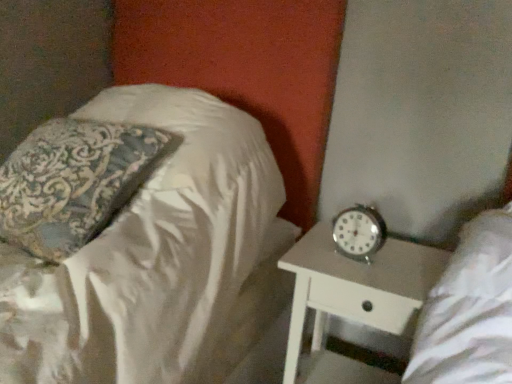
What do you see at coordinates (159, 260) in the screenshot? The height and width of the screenshot is (384, 512). I see `silky white pillow at upper left` at bounding box center [159, 260].

What do you see at coordinates (359, 232) in the screenshot? I see `metallic silver clock at right` at bounding box center [359, 232].

Measure the distance between white glossy nightstand at lower right and camera.

The depth of white glossy nightstand at lower right is 37.80 inches.

This screenshot has height=384, width=512. Find the location of `silky white pillow at upper left`. silky white pillow at upper left is located at coordinates (159, 260).

Consider the image. Who is smaller, metallic silver clock at right or silky white pillow at upper left?

metallic silver clock at right.

Is metallic silver clock at right not within silky white pillow at upper left?

Yes.

From the image's perspective, which object appears higher, metallic silver clock at right or silky white pillow at upper left?

silky white pillow at upper left is shown above in the image.

Is white glossy nightstand at lower right positioned with its back to silky white pillow at upper left?

No, silky white pillow at upper left is not at the back of white glossy nightstand at lower right.

Is white glossy nightstand at lower right positioned behind silky white pillow at upper left?

Yes, it is behind silky white pillow at upper left.

Considering the relative sizes of white glossy nightstand at lower right and silky white pillow at upper left in the image provided, is white glossy nightstand at lower right taller than silky white pillow at upper left?

Indeed, white glossy nightstand at lower right has a greater height compared to silky white pillow at upper left.

In the scene shown: From a real-world perspective, is white glossy nightstand at lower right positioned under silky white pillow at upper left based on gravity?

Yes, from a real-world perspective, white glossy nightstand at lower right is beneath silky white pillow at upper left.

Which is further, (339, 224) or (326, 289)?

The point (339, 224) is more distant.

Would you say white glossy nightstand at lower right is part of metallic silver clock at right's contents?

That's incorrect, white glossy nightstand at lower right is not inside metallic silver clock at right.

Who is taller, metallic silver clock at right or white glossy nightstand at lower right?

white glossy nightstand at lower right.

Is metallic silver clock at right aimed at white glossy nightstand at lower right?

No, metallic silver clock at right is not facing towards white glossy nightstand at lower right.

Image resolution: width=512 pixels, height=384 pixels. Find the location of `bed located above the white glossy nightstand at lower right (from the image's perspective)`. bed located above the white glossy nightstand at lower right (from the image's perspective) is located at coordinates (159, 260).

Could you tell me if silky white pillow at upper left is facing white glossy nightstand at lower right?

No.

Is silky white pillow at upper left in front of or behind white glossy nightstand at lower right in the image?

Visually, silky white pillow at upper left is located in front of white glossy nightstand at lower right.

From the image's perspective, does silky white pillow at upper left appear lower than white glossy nightstand at lower right?

Incorrect, from the image's perspective, silky white pillow at upper left is higher than white glossy nightstand at lower right.

Is point (328, 277) behind point (371, 211)?

No, (328, 277) is in front of (371, 211).

How different are the orientations of white glossy nightstand at lower right and metallic silver clock at right in degrees?

The angular difference between white glossy nightstand at lower right and metallic silver clock at right is 12 degrees.

From the image's perspective, does white glossy nightstand at lower right appear higher than metallic silver clock at right?

No, from the image's perspective, white glossy nightstand at lower right is not above metallic silver clock at right.

From a real-world perspective, between white glossy nightstand at lower right and metallic silver clock at right, who is vertically lower?

white glossy nightstand at lower right is physically lower.

Does silky white pillow at upper left have a greater height compared to metallic silver clock at right?

Correct, silky white pillow at upper left is much taller as metallic silver clock at right.

Considering the positions of point (194, 100) and point (346, 209), is point (194, 100) closer or farther from the camera than point (346, 209)?

Point (194, 100) is positioned closer to the camera compared to point (346, 209).

How many degrees apart are the facing directions of silky white pillow at upper left and metallic silver clock at right?

9.91 degrees separate the facing orientations of silky white pillow at upper left and metallic silver clock at right.

In terms of width, does silky white pillow at upper left look wider or thinner when compared to metallic silver clock at right?

silky white pillow at upper left is wider than metallic silver clock at right.

In the image, there is a silky white pillow at upper left. Identify the location of clock below it (from a real-world perspective). This screenshot has height=384, width=512. (359, 232).

This screenshot has height=384, width=512. In order to click on bed that appears above the white glossy nightstand at lower right (from a real-world perspective) in this screenshot , I will do pyautogui.click(x=159, y=260).

Considering their positions, is metallic silver clock at right positioned further to white glossy nightstand at lower right than silky white pillow at upper left?

silky white pillow at upper left is further to white glossy nightstand at lower right.

Which object lies nearer to the anchor point silky white pillow at upper left, white glossy nightstand at lower right or metallic silver clock at right?

Based on the image, white glossy nightstand at lower right appears to be nearer to silky white pillow at upper left.

Based on their spatial positions, is silky white pillow at upper left or metallic silver clock at right further from white glossy nightstand at lower right?

silky white pillow at upper left is further to white glossy nightstand at lower right.

Estimate the real-world distances between objects in this image. Which object is closer to silky white pillow at upper left, metallic silver clock at right or white glossy nightstand at lower right?

The object closer to silky white pillow at upper left is white glossy nightstand at lower right.

When comparing their distances from metallic silver clock at right, does silky white pillow at upper left or white glossy nightstand at lower right seem closer?

Among the two, white glossy nightstand at lower right is located nearer to metallic silver clock at right.

From the image, which object appears to be farther from metallic silver clock at right, white glossy nightstand at lower right or silky white pillow at upper left?

silky white pillow at upper left lies further to metallic silver clock at right than the other object.

Locate an element on the screen. The width and height of the screenshot is (512, 384). clock between silky white pillow at upper left and white glossy nightstand at lower right from left to right is located at coordinates (359, 232).